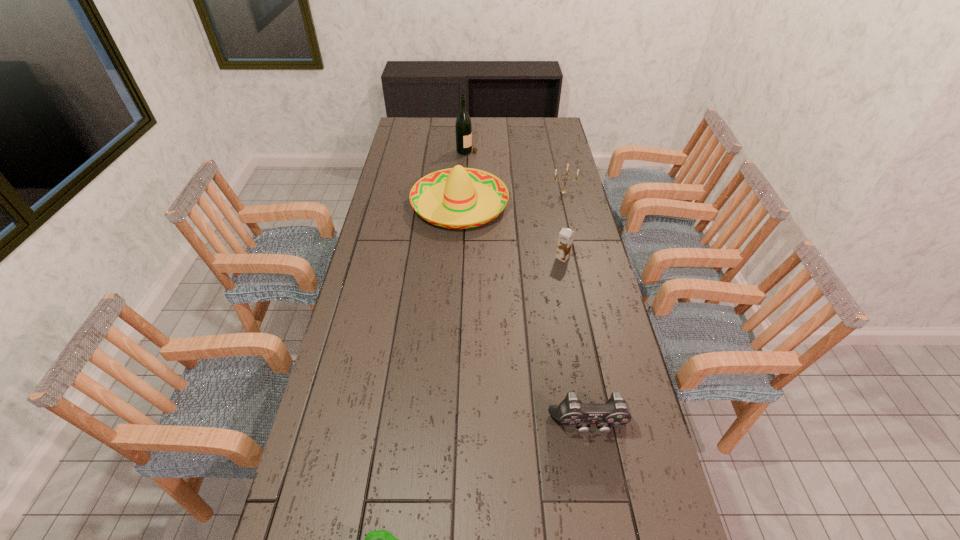
In order to click on the farthest object in this screenshot , I will do `click(463, 125)`.

At what (x,y) coordinates should I click in order to perform the action: click on the tallest object. Please return your answer as a coordinate pair (x, y). Looking at the image, I should click on (463, 125).

You are a GUI agent. You are given a task and a screenshot of the screen. Output one action in this format:
    pyautogui.click(x=<x>, y=<y>)
    Task: Click on the second tallest object
    
    Given the screenshot: What is the action you would take?
    (456, 198)

Locate an element on the screen. candle is located at coordinates (563, 191).

Locate an element on the screen. The image size is (960, 540). the third nearest object is located at coordinates (565, 240).

This screenshot has width=960, height=540. What are the coordinates of `the fifth farthest object` in the screenshot? It's located at (571, 412).

At what (x,y) coordinates should I click in order to perform the action: click on vacant area situated on the left of the wine bottle. Please return your answer as a coordinate pair (x, y). This screenshot has width=960, height=540. Looking at the image, I should click on (405, 150).

In order to click on free space located on the back of the sombrero in this screenshot , I will do `click(464, 141)`.

Locate an element on the screen. This screenshot has width=960, height=540. vacant space positioned on the front of the candle is located at coordinates (567, 209).

Where is `free space located on the back of the third nearest object`? free space located on the back of the third nearest object is located at coordinates (557, 226).